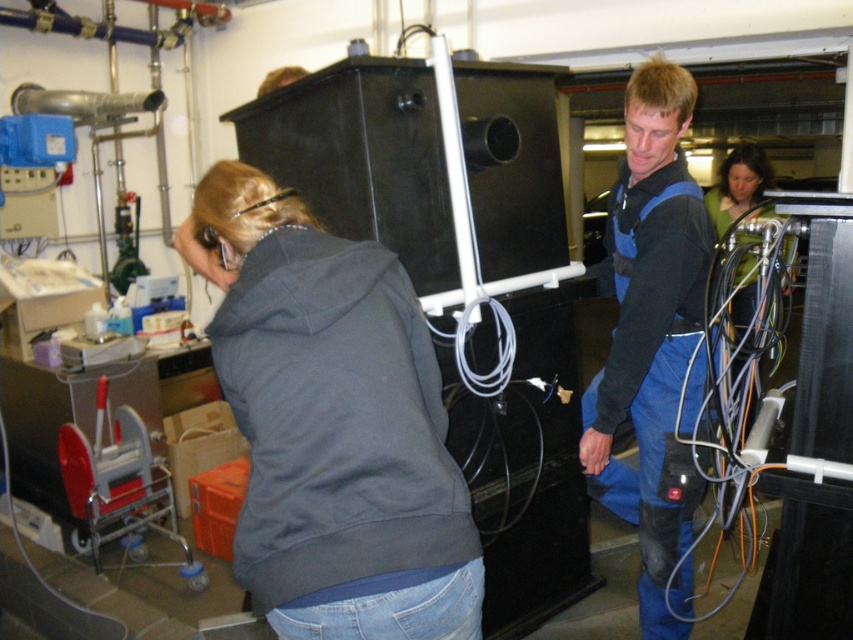
What do you see at coordinates (650, 326) in the screenshot?
I see `blue denim coveralls at center` at bounding box center [650, 326].

Can you confirm if blue denim coveralls at center is positioned to the left of black rubber wires at right?

Yes, blue denim coveralls at center is to the left of black rubber wires at right.

Who is more forward, (631, 196) or (733, 490)?

Positioned in front is point (733, 490).

The height and width of the screenshot is (640, 853). I want to click on blue denim coveralls at center, so click(x=650, y=326).

Does dark gray fleece sweatshirt at center lie behind black rubber wires at right?

No, dark gray fleece sweatshirt at center is closer to the viewer.

Find the location of a particular element. This screenshot has height=640, width=853. dark gray fleece sweatshirt at center is located at coordinates (335, 424).

Which is in front, point (332, 310) or point (756, 216)?

Point (332, 310) is more forward.

I want to click on dark gray fleece sweatshirt at center, so click(335, 424).

Does dark gray fleece sweatshirt at center appear over blue denim coveralls at center?

No.

Looking at this image, is dark gray fleece sweatshirt at center further to the viewer compared to blue denim coveralls at center?

No.

Is point (448, 544) positioned behind point (605, 470)?

No, (448, 544) is closer to viewer.

At what (x,y) coordinates should I click in order to perform the action: click on dark gray fleece sweatshirt at center. Please return your answer as a coordinate pair (x, y). Looking at the image, I should click on (335, 424).